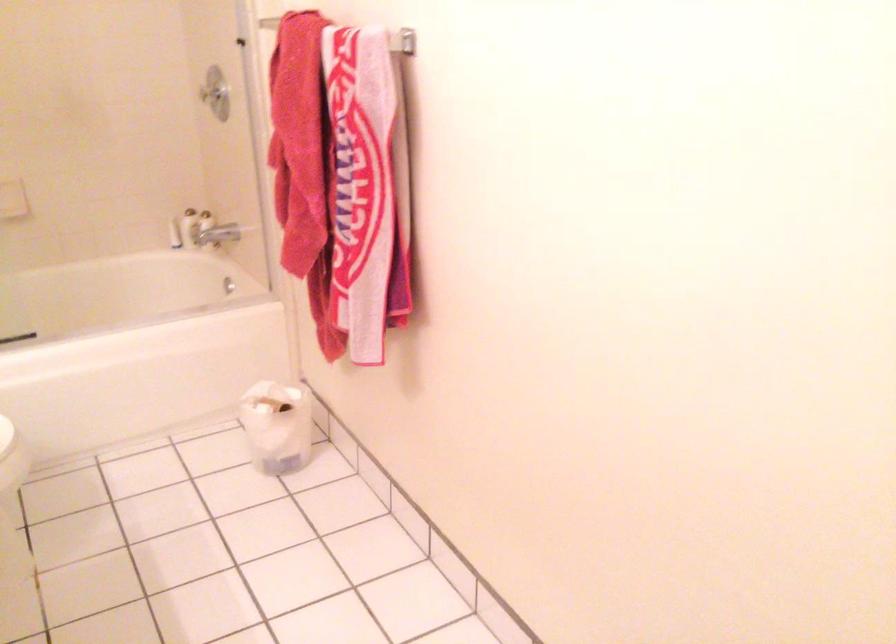
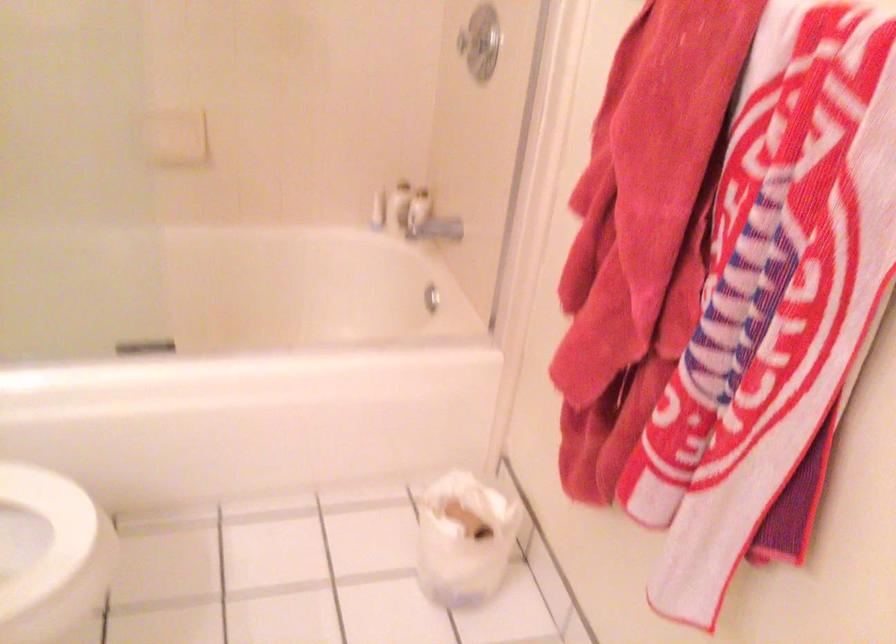
In the second image, find the point that corresponds to point 192,228 in the first image.

(399, 205)